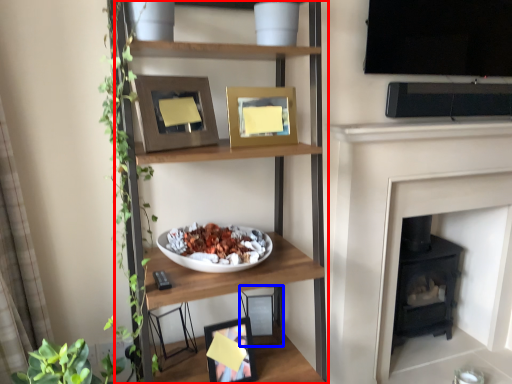
Question: Which of the following is the closest to the observer, shelf (highlighted by a red box) or picture frame (highlighted by a blue box)?

Choices:
 (A) shelf
 (B) picture frame

Answer: (A)